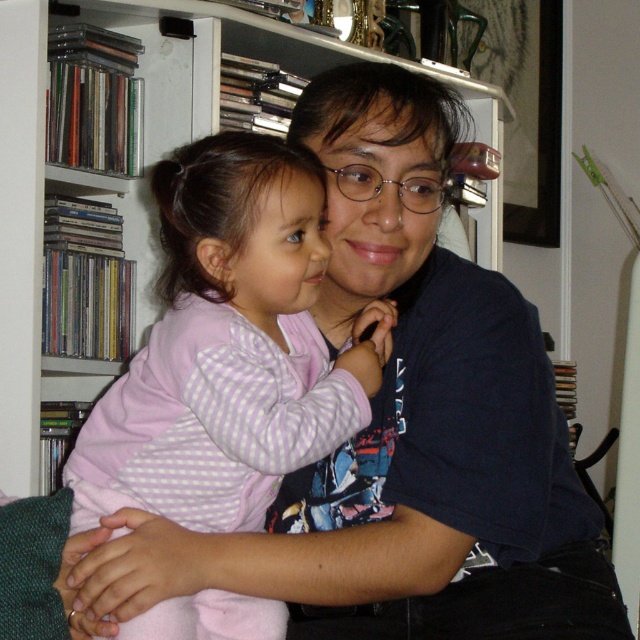
Question: Which of the following is the closest to the observer?

Choices:
 (A) (237, 198)
 (B) (29, 28)

Answer: (A)

Question: Is pink checkered pajamas at center wider than white plastic bookshelf at upper center?

Choices:
 (A) yes
 (B) no

Answer: (B)

Question: Can you confirm if pink checkered pajamas at center is positioned to the right of white plastic bookshelf at upper center?

Choices:
 (A) yes
 (B) no

Answer: (B)

Question: Can you confirm if pink checkered pajamas at center is bigger than white plastic bookshelf at upper center?

Choices:
 (A) yes
 (B) no

Answer: (B)